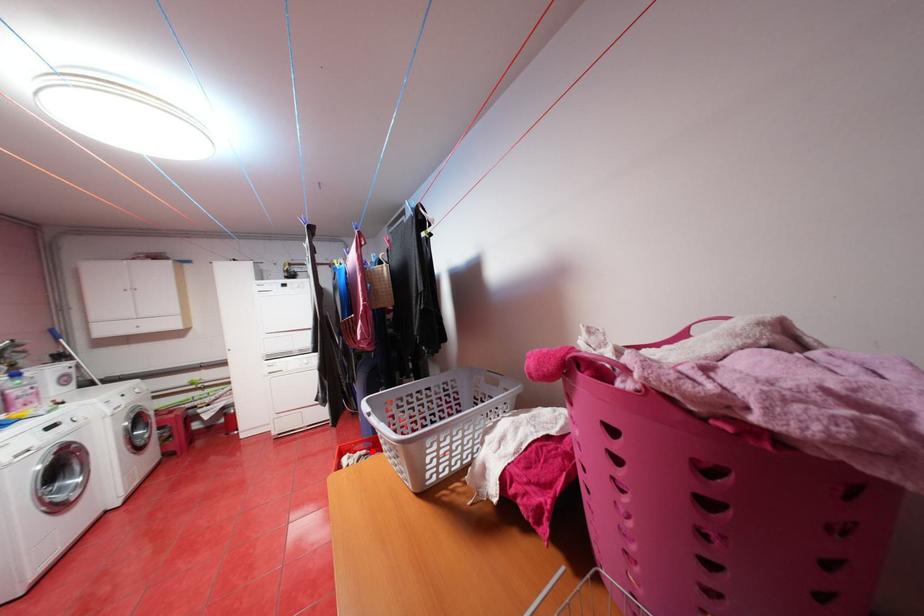
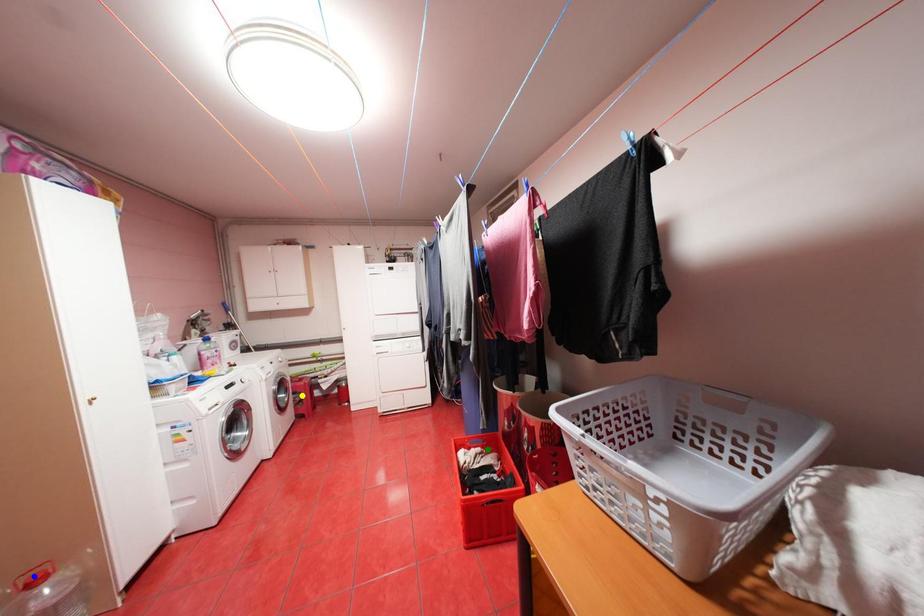
Question: I am providing you with two images of the same scene from different viewpoints. A red point is marked on the first image. You are given multiple points on the second image. Which point in image 2 is actually the same real-world point as the red point in image 1?

Choices:
 (A) green point
 (B) yellow point
 (C) blue point

Answer: (A)